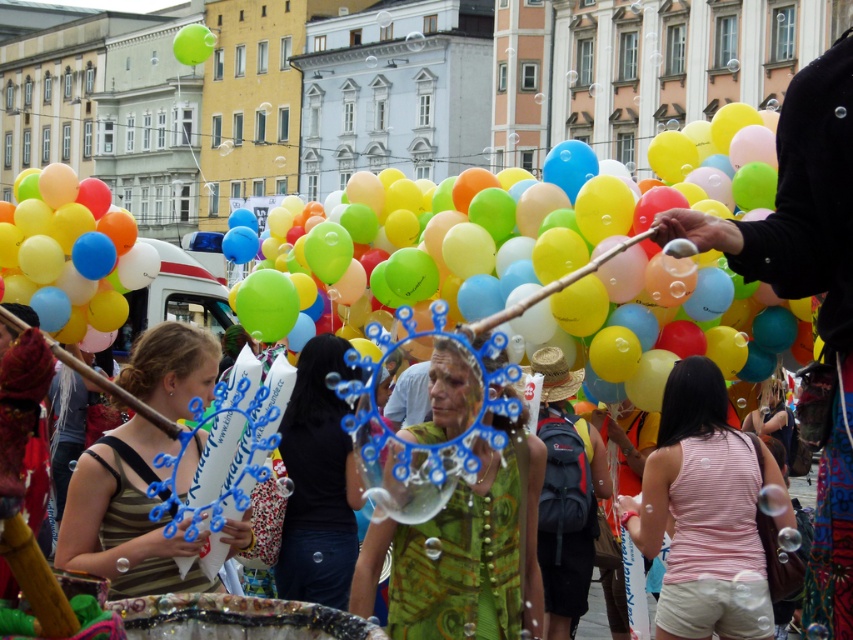
You are a photographer trying to capture the scene with your camera. You want to ensure that both the black fabric at upper right and the straw hat at center are visible in your shot. Based on their positions, which object should you focus on first to make sure both are in frame?

The black fabric at upper right is above the straw hat at center, so you should focus on the black fabric at upper right first to ensure both are in frame.